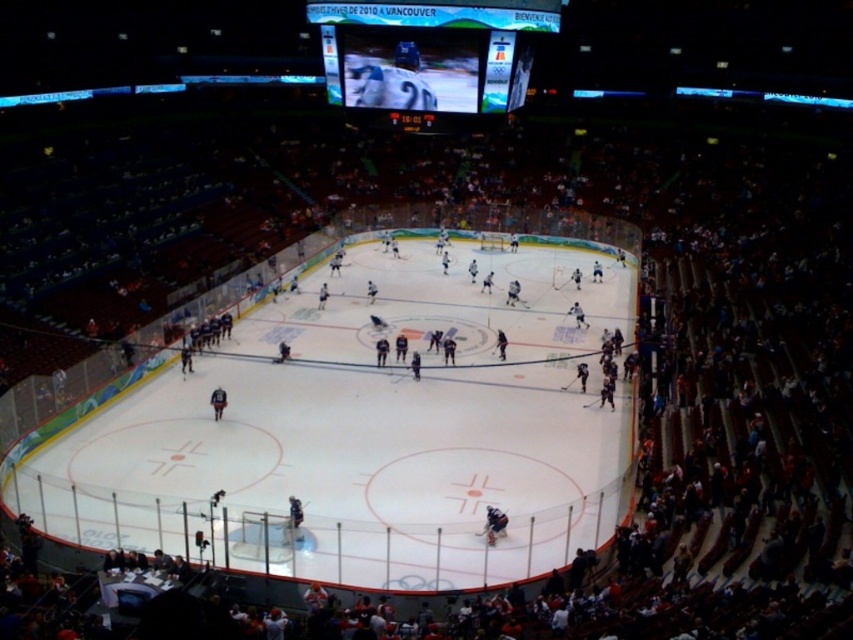
You are a hockey player standing at the edge of the ice. You need to skate to the white smooth ice at center. Which direction should you move?

You should move toward the center of the rink to reach the white smooth ice at center.